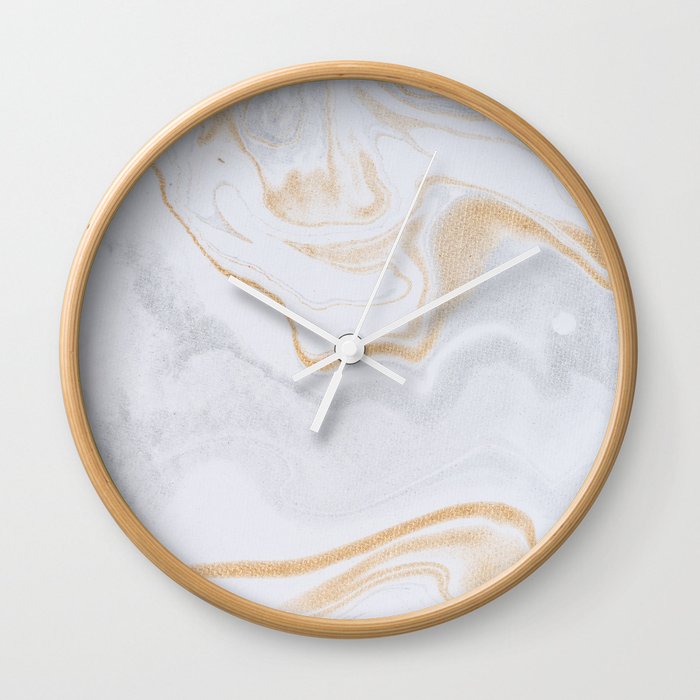
Find the location of a particular element. wooden frame is located at coordinates (309, 76).